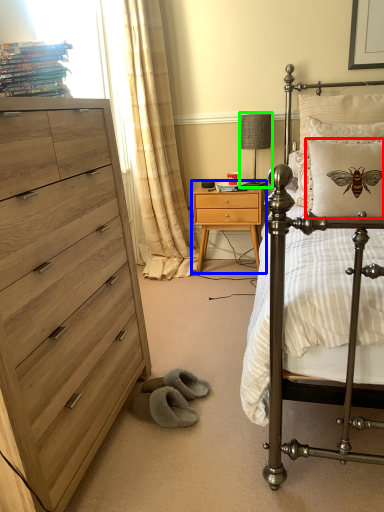
Question: Estimate the real-world distances between objects in this image. Which object is closer to pillow (highlighted by a red box), nightstand (highlighted by a blue box) or table lamp (highlighted by a green box)?

Choices:
 (A) nightstand
 (B) table lamp

Answer: (A)